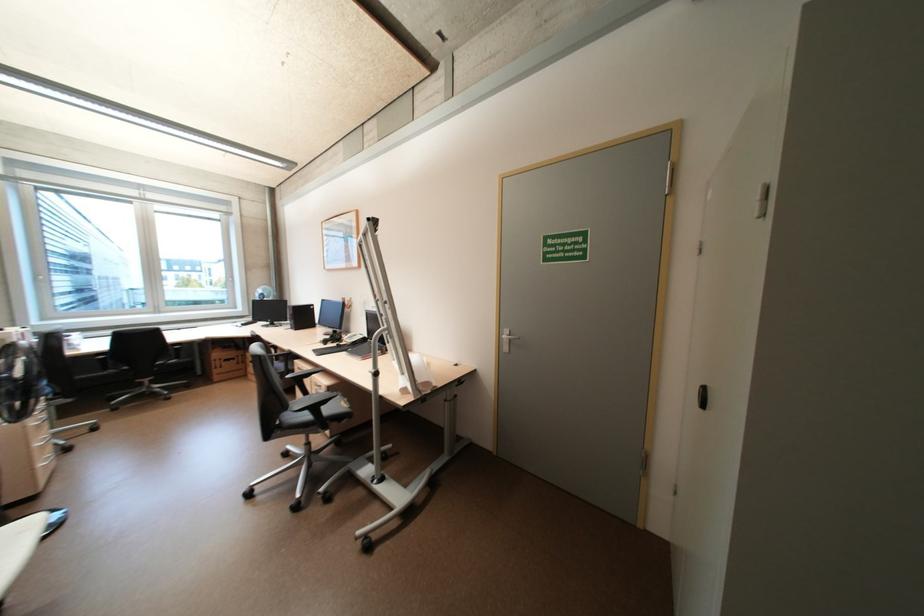
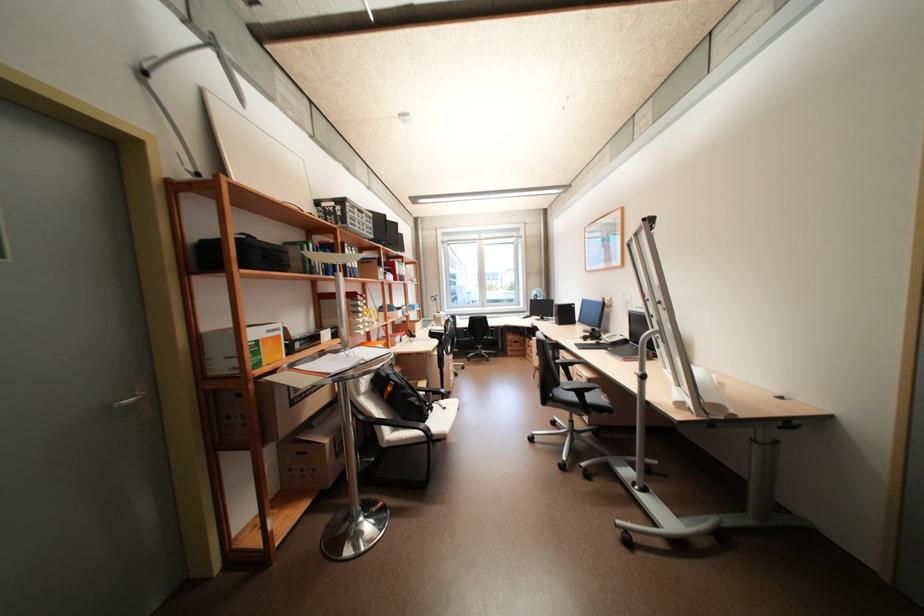
The point at (x=331, y=400) is marked in the first image. Where is the corresponding point in the second image?

(593, 390)